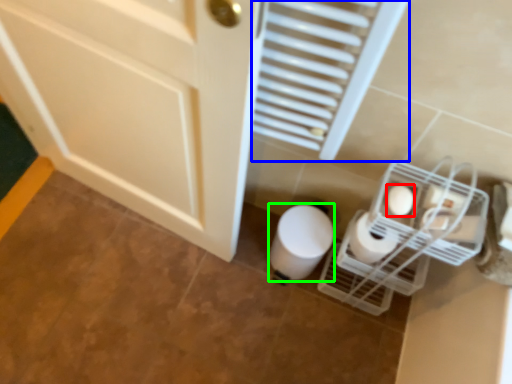
Question: Which object is the closest to the toilet paper (highlighted by a red box)? Choose among these: radiator (highlighted by a blue box) or toilet paper (highlighted by a green box).

Choices:
 (A) radiator
 (B) toilet paper

Answer: (A)